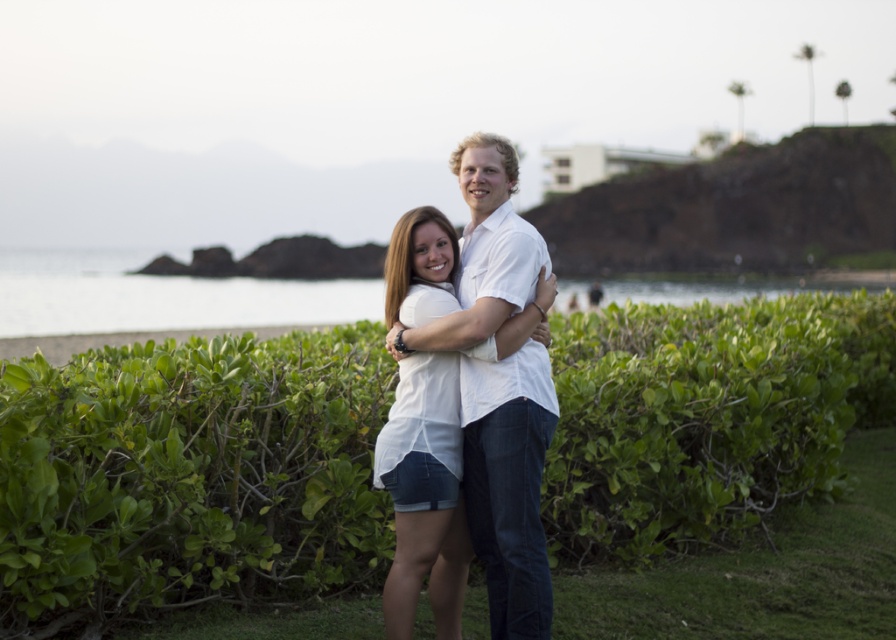
Can you confirm if green leafy hedge at center is bigger than white cotton shirt at center?

Indeed, green leafy hedge at center has a larger size compared to white cotton shirt at center.

Is green leafy hedge at center to the right of white cotton shirt at center from the viewer's perspective?

Correct, you'll find green leafy hedge at center to the right of white cotton shirt at center.

Between point (843, 419) and point (501, 436), which one is positioned in front?

Point (501, 436)

Where is `green leafy hedge at center`? The image size is (896, 640). green leafy hedge at center is located at coordinates (188, 476).